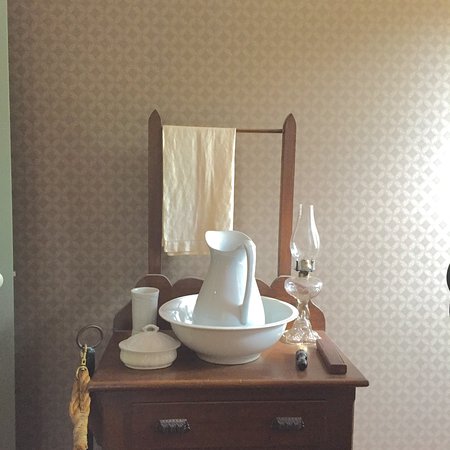
At what (x,y) coordinates should I click in order to perform the action: click on porcelain/ceramic wash basin. Please return your answer as a coordinate pair (x, y). Image resolution: width=450 pixels, height=450 pixels. Looking at the image, I should click on (209, 346).